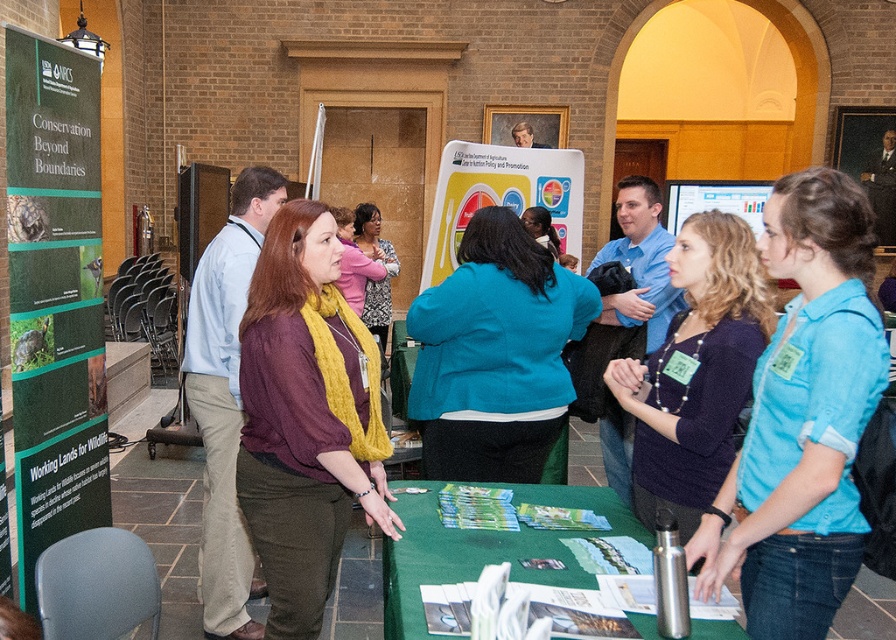
You are standing at the center of the room and want to locate the green matte poster at left. According to the coordinates provided, in which direction should you move to face the poster?

The green matte poster at left is located at coordinates point (54, 296). Since you are at the center, you should move to your left to face the poster.